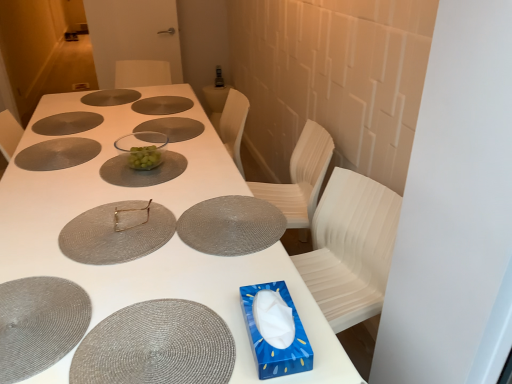
This screenshot has width=512, height=384. In order to click on vacant region to the left of matte gray glass plate at center, the eighth glass plate viewed from the front in this screenshot , I will do click(x=104, y=99).